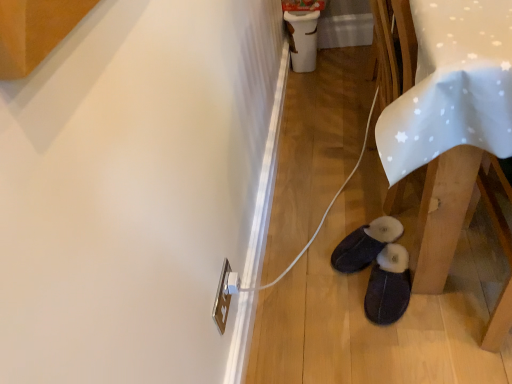
Identify the location of dark gray suede slippers at lower center, the 1th footwear when ordered from front to back. The height and width of the screenshot is (384, 512). (388, 286).

This screenshot has height=384, width=512. What do you see at coordinates (365, 244) in the screenshot? I see `dark suede slippers at lower center, the 1th footwear from the back` at bounding box center [365, 244].

The image size is (512, 384). Identify the location of dark suede slippers at lower center, which appears as the second footwear when viewed from the front. pos(365,244).

Locate an element on the screen. This screenshot has width=512, height=384. dark gray suede slippers at lower center, the 1th footwear when ordered from front to back is located at coordinates (388, 286).

Looking at this image, is white fabric table at lower right positioned before dark suede slippers at lower center, the 1th footwear from the back?

Yes, white fabric table at lower right is closer to the viewer.

The height and width of the screenshot is (384, 512). In order to click on table in front of the dark suede slippers at lower center, which appears as the second footwear when viewed from the front in this screenshot , I will do `click(447, 120)`.

Between white fabric table at lower right and dark suede slippers at lower center, which appears as the second footwear when viewed from the front, which one has larger size?

With larger size is white fabric table at lower right.

Which of these two, white fabric table at lower right or dark suede slippers at lower center, which appears as the second footwear when viewed from the front, stands taller?

white fabric table at lower right.

Is dark gray suede slippers at lower center, the 1th footwear when ordered from front to back, far away from white fabric table at lower right?

No, dark gray suede slippers at lower center, the 1th footwear when ordered from front to back, is in close proximity to white fabric table at lower right.

Considering the relative positions of dark gray suede slippers at lower center, the 1th footwear when ordered from front to back, and white fabric table at lower right in the image provided, is dark gray suede slippers at lower center, the 1th footwear when ordered from front to back, to the left or to the right of white fabric table at lower right?

dark gray suede slippers at lower center, the 1th footwear when ordered from front to back, is positioned on white fabric table at lower right's left side.

From a real-world perspective, is dark gray suede slippers at lower center, arranged as the 2th footwear when viewed from the back, physically above white fabric table at lower right?

No, from a real-world perspective, dark gray suede slippers at lower center, arranged as the 2th footwear when viewed from the back, is not above white fabric table at lower right.

From the image's perspective, which one is positioned higher, white fabric table at lower right or dark gray suede slippers at lower center, the 1th footwear when ordered from front to back?

white fabric table at lower right.

Is white fabric table at lower right far from dark gray suede slippers at lower center, the 1th footwear when ordered from front to back?

No, white fabric table at lower right is not far from dark gray suede slippers at lower center, the 1th footwear when ordered from front to back.

Do you think white fabric table at lower right is within dark gray suede slippers at lower center, arranged as the 2th footwear when viewed from the back, or outside of it?

white fabric table at lower right is not inside dark gray suede slippers at lower center, arranged as the 2th footwear when viewed from the back, it's outside.

I want to click on footwear located in front of the dark suede slippers at lower center, which appears as the second footwear when viewed from the front, so click(x=388, y=286).

From a real-world perspective, is dark gray suede slippers at lower center, arranged as the 2th footwear when viewed from the back, physically above dark suede slippers at lower center, which appears as the second footwear when viewed from the front?

Indeed, from a real-world perspective, dark gray suede slippers at lower center, arranged as the 2th footwear when viewed from the back, stands above dark suede slippers at lower center, which appears as the second footwear when viewed from the front.

Between dark suede slippers at lower center, which appears as the second footwear when viewed from the front, and white fabric table at lower right, which one is positioned in front?

white fabric table at lower right is in front.

Which of these two, dark suede slippers at lower center, which appears as the second footwear when viewed from the front, or white fabric table at lower right, stands taller?

With more height is white fabric table at lower right.

Is dark suede slippers at lower center, which appears as the second footwear when viewed from the front, next to white fabric table at lower right?

dark suede slippers at lower center, which appears as the second footwear when viewed from the front, and white fabric table at lower right are clearly separated.

From a real-world perspective, is dark suede slippers at lower center, the 1th footwear from the back, positioned under white fabric table at lower right based on gravity?

Indeed, from a real-world perspective, dark suede slippers at lower center, the 1th footwear from the back, is positioned beneath white fabric table at lower right.

Is dark suede slippers at lower center, the 1th footwear from the back, facing towards dark gray suede slippers at lower center, arranged as the 2th footwear when viewed from the back?

No.

Is dark suede slippers at lower center, the 1th footwear from the back, closer to camera compared to dark gray suede slippers at lower center, the 1th footwear when ordered from front to back?

No, it is behind dark gray suede slippers at lower center, the 1th footwear when ordered from front to back.

From the image's perspective, is dark suede slippers at lower center, the 1th footwear from the back, above dark gray suede slippers at lower center, arranged as the 2th footwear when viewed from the back?

Yes.

The height and width of the screenshot is (384, 512). I want to click on table above the dark suede slippers at lower center, which appears as the second footwear when viewed from the front (from a real-world perspective), so click(447, 120).

Find the location of a particular element. table located on the right of dark gray suede slippers at lower center, arranged as the 2th footwear when viewed from the back is located at coordinates (447, 120).

Which object lies further to the anchor point white fabric table at lower right, dark suede slippers at lower center, the 1th footwear from the back, or dark gray suede slippers at lower center, the 1th footwear when ordered from front to back?

dark suede slippers at lower center, the 1th footwear from the back.

Based on their spatial positions, is white fabric table at lower right or dark suede slippers at lower center, the 1th footwear from the back, closer to dark gray suede slippers at lower center, the 1th footwear when ordered from front to back?

dark suede slippers at lower center, the 1th footwear from the back, lies closer to dark gray suede slippers at lower center, the 1th footwear when ordered from front to back, than the other object.

Considering their positions, is dark gray suede slippers at lower center, the 1th footwear when ordered from front to back, positioned closer to white fabric table at lower right than dark suede slippers at lower center, the 1th footwear from the back?

dark gray suede slippers at lower center, the 1th footwear when ordered from front to back, lies closer to white fabric table at lower right than the other object.

Considering their positions, is dark gray suede slippers at lower center, arranged as the 2th footwear when viewed from the back, positioned further to dark suede slippers at lower center, which appears as the second footwear when viewed from the front, than white fabric table at lower right?

white fabric table at lower right.

From the picture: Looking at the image, which one is located closer to dark gray suede slippers at lower center, the 1th footwear when ordered from front to back, dark suede slippers at lower center, the 1th footwear from the back, or white fabric table at lower right?

Based on the image, dark suede slippers at lower center, the 1th footwear from the back, appears to be nearer to dark gray suede slippers at lower center, the 1th footwear when ordered from front to back.

Which object lies nearer to the anchor point dark suede slippers at lower center, the 1th footwear from the back, white fabric table at lower right or dark gray suede slippers at lower center, the 1th footwear when ordered from front to back?

The object closer to dark suede slippers at lower center, the 1th footwear from the back, is dark gray suede slippers at lower center, the 1th footwear when ordered from front to back.

Identify the location of footwear between white fabric table at lower right and dark suede slippers at lower center, which appears as the second footwear when viewed from the front, from front to back. (388, 286).